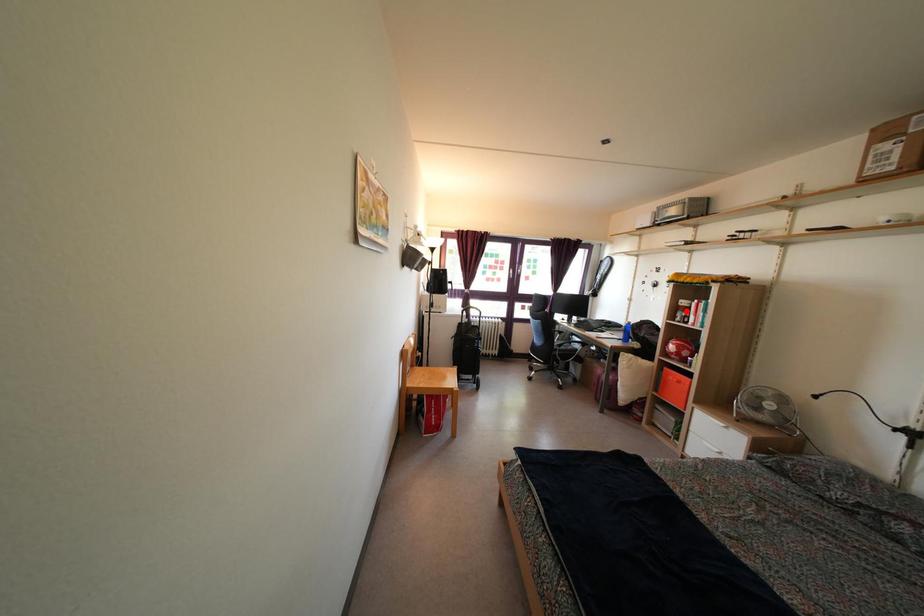
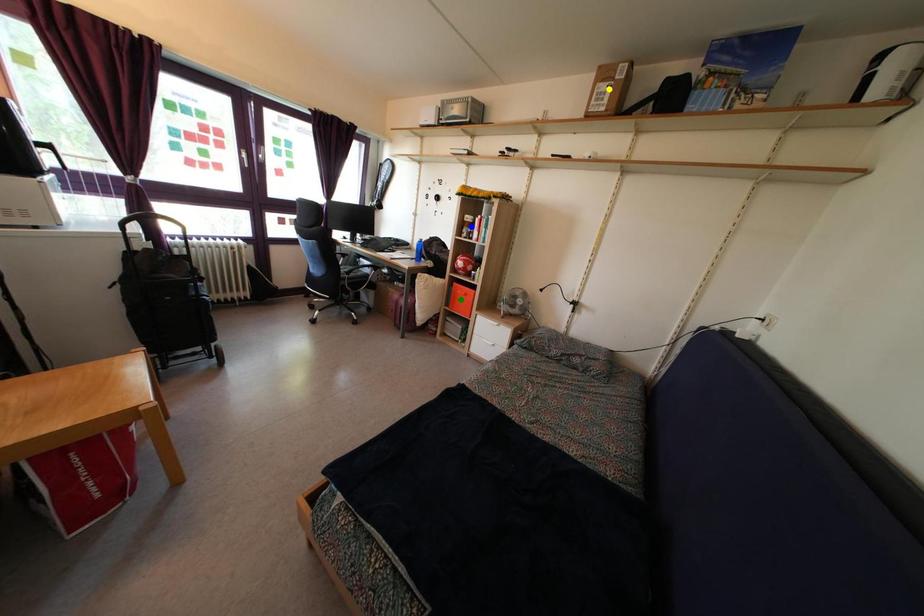
Question: I am providing you with two images of the same scene from different viewpoints. A red point is marked on the first image. You are given multiple points on the second image. Which spot in image 2 lines up with the point in image 1?

Choices:
 (A) blue point
 (B) green point
 (C) yellow point

Answer: (A)